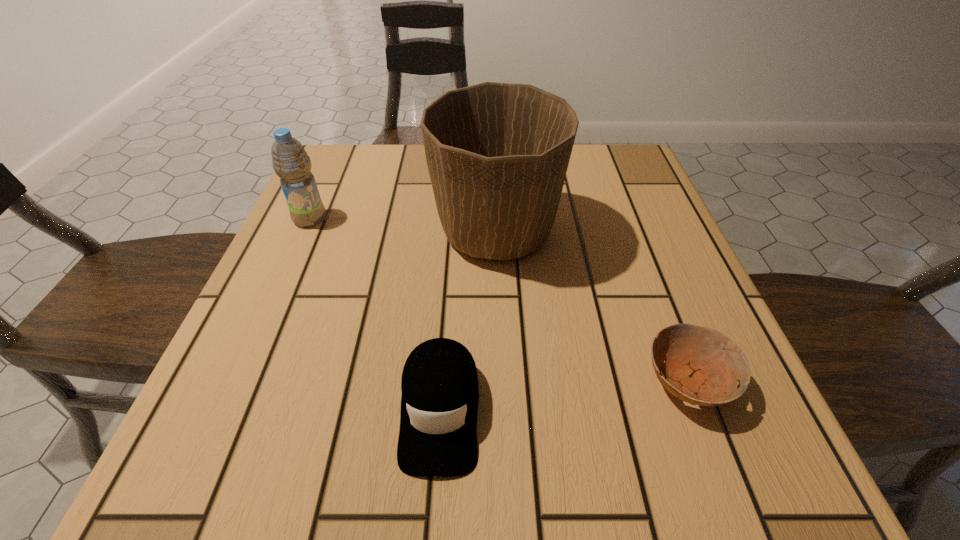
Identify the location of empty location between the water bottle and the rightmost object. The height and width of the screenshot is (540, 960). (498, 300).

Locate an element on the screen. vacant space that's between the water bottle and the tallest object is located at coordinates (403, 226).

Locate an element on the screen. free area in between the water bottle and the second shortest object is located at coordinates (375, 314).

Locate an element on the screen. The height and width of the screenshot is (540, 960). empty location between the shortest object and the flowerpot is located at coordinates (591, 307).

Where is `empty space between the shortest object and the cap`? empty space between the shortest object and the cap is located at coordinates (563, 396).

This screenshot has width=960, height=540. What are the coordinates of `free space between the rightmost object and the leftmost object` in the screenshot? It's located at (498, 300).

Locate an element on the screen. vacant space in between the tallest object and the rightmost object is located at coordinates (591, 307).

Find the location of a particular element. The image size is (960, 540). unoccupied area between the cap and the shortest object is located at coordinates (563, 396).

The width and height of the screenshot is (960, 540). I want to click on the second closest object to the water bottle, so pos(440,393).

Locate which object is the second closest to the water bottle. Please provide its 2D coordinates. Your answer should be formatted as a tuple, i.e. [(x, y)], where the tuple contains the x and y coordinates of a point satisfying the conditions above.

[(440, 393)]